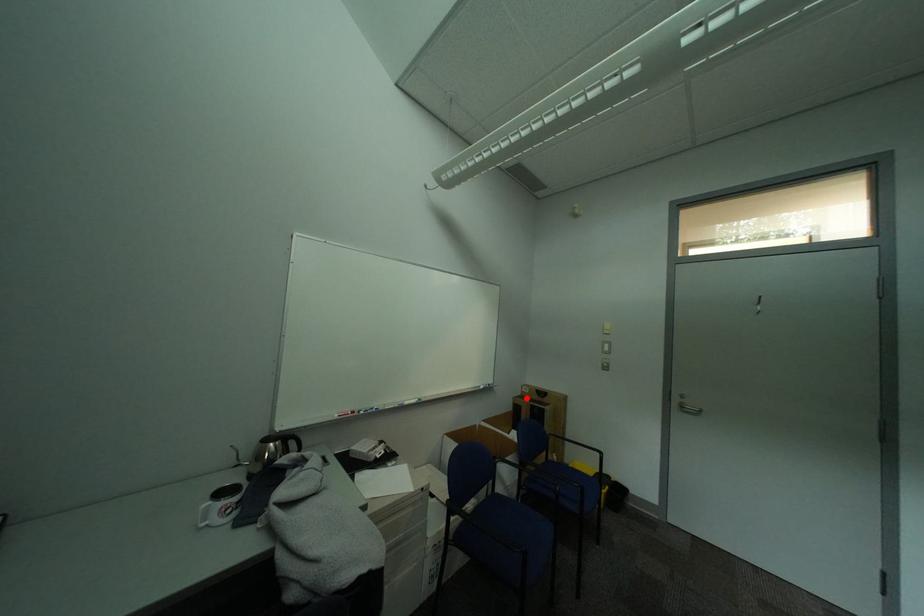
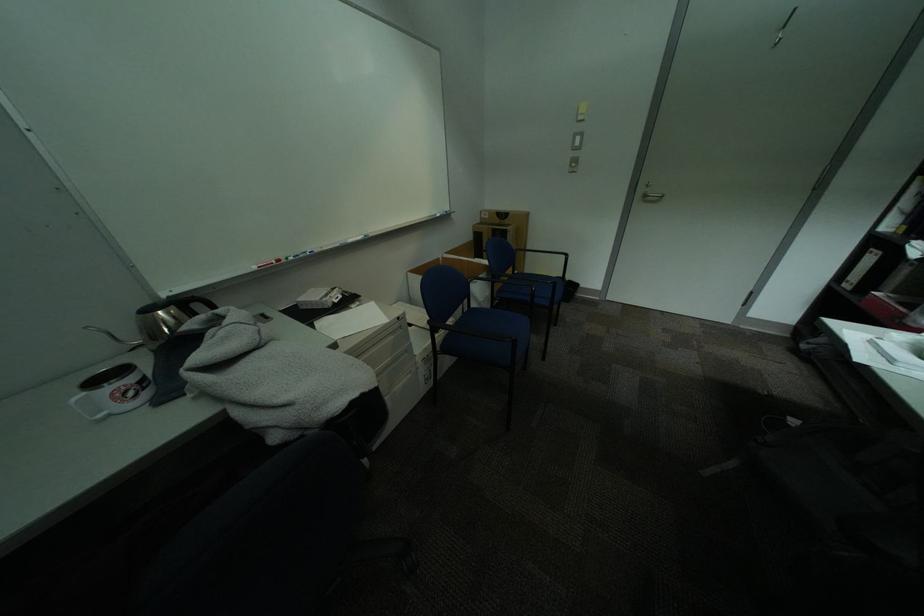
The point at the highlighted location is marked in the first image. Where is the corresponding point in the second image?

(487, 225)